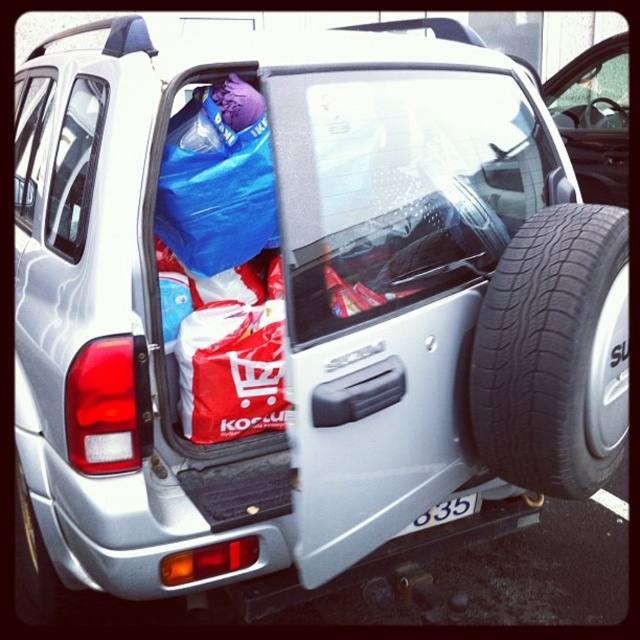
Is black rubber tire at rear to the left of matte black car door at upper center from the viewer's perspective?

Indeed, black rubber tire at rear is positioned on the left side of matte black car door at upper center.

Who is positioned more to the left, black rubber tire at rear or matte black car door at upper center?

From the viewer's perspective, black rubber tire at rear appears more on the left side.

Find the location of a particular element. black rubber tire at rear is located at coordinates (554, 353).

The image size is (640, 640). In order to click on matte black car door at upper center in this screenshot , I will do `click(595, 116)`.

Which is in front, point (602, 64) or point (468, 499)?

Point (468, 499) is more forward.

Does point (586, 74) come closer to viewer compared to point (422, 516)?

No.

Locate an element on the screen. The width and height of the screenshot is (640, 640). matte black car door at upper center is located at coordinates (595, 116).

Between black rubber tire at rear and white plastic license plate at center, which one is positioned lower?

white plastic license plate at center

Between black rubber tire at rear and white plastic license plate at center, which one appears on the right side from the viewer's perspective?

Positioned to the right is black rubber tire at rear.

Where is `black rubber tire at rear`? black rubber tire at rear is located at coordinates (554, 353).